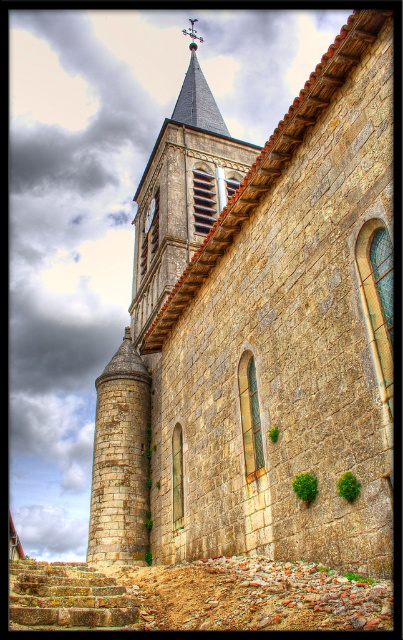
You are standing in front of the historic stone church and want to take a photo that includes the entire stone steeple at upper center. Your camera can focus on objects up to 50 meters away. Will the steeple be in focus?

The stone steeple at upper center is 56.42 meters away from the viewer. Since the camera can only focus up to 50 meters, the steeple will be out of focus.